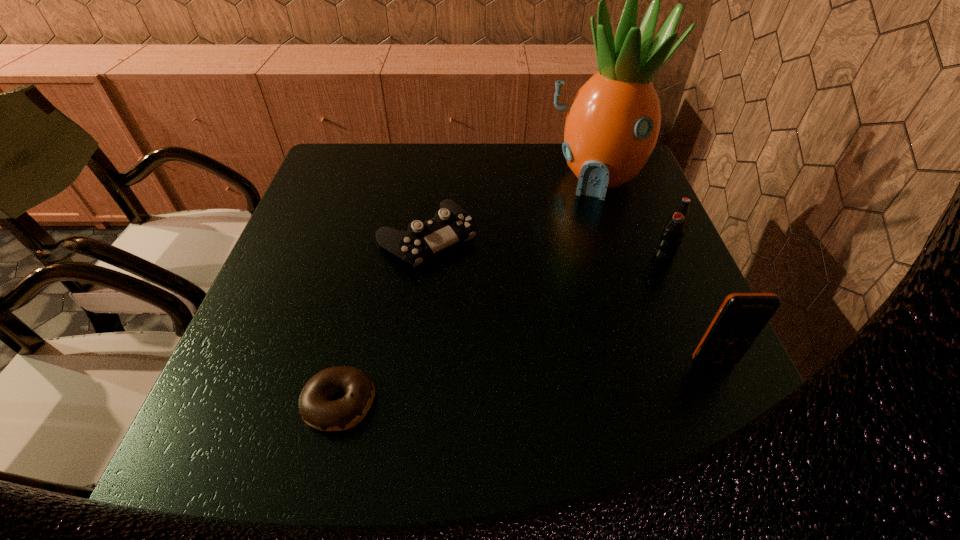
Identify the location of the nearest object. The width and height of the screenshot is (960, 540). (316, 409).

Image resolution: width=960 pixels, height=540 pixels. Identify the location of the shortest object. (316, 409).

Find the location of a particular element. cellular telephone is located at coordinates (742, 316).

At what (x,y) coordinates should I click in order to perform the action: click on pop. Please return your answer as a coordinate pair (x, y). Looking at the image, I should click on (675, 228).

This screenshot has height=540, width=960. What are the coordinates of `the second shortest object` in the screenshot? It's located at (451, 223).

Locate an element on the screen. This screenshot has height=540, width=960. the tallest object is located at coordinates (612, 125).

Find the location of a particular element. This screenshot has width=960, height=540. the farthest object is located at coordinates (612, 125).

You are a GUI agent. You are given a task and a screenshot of the screen. Output one action in this format:
    pyautogui.click(x=<x>, y=<y>)
    Task: Click on the vacant space positioned 0.150m on the left of the nearest object
    The width and height of the screenshot is (960, 540).
    Given the screenshot: What is the action you would take?
    pyautogui.click(x=217, y=402)

Where is `vacant space located on the screen of the cellular telephone`? vacant space located on the screen of the cellular telephone is located at coordinates (743, 429).

At what (x,y) coordinates should I click in order to perform the action: click on vacant space located 0.130m on the front label of the pop. Please return your answer as a coordinate pair (x, y). This screenshot has width=960, height=540. Looking at the image, I should click on tap(635, 295).